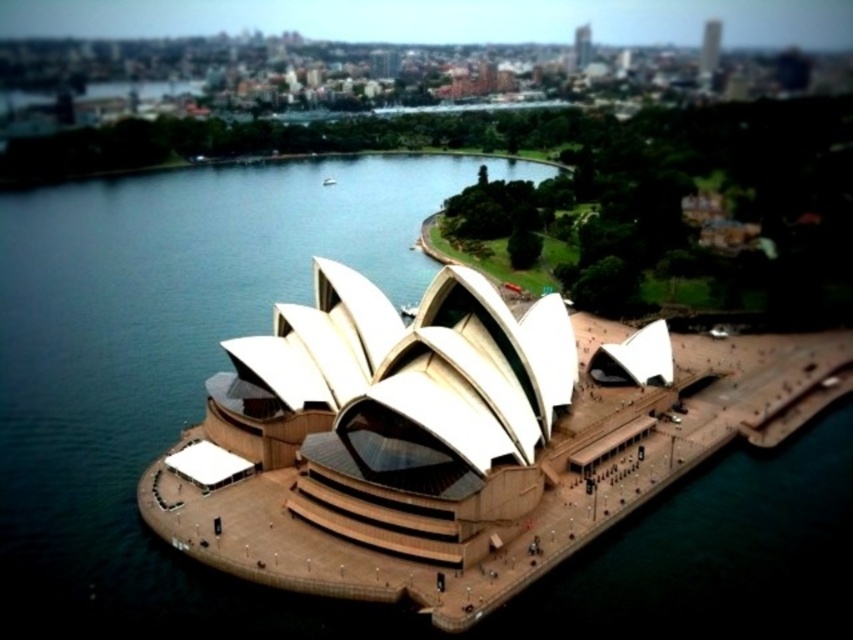
Is white glossy boat at center positioned before white matte boat at center?

Yes, white glossy boat at center is closer to the viewer.

Where is `white glossy boat at center`? The height and width of the screenshot is (640, 853). white glossy boat at center is located at coordinates (408, 308).

Is point (410, 310) closer to camera compared to point (334, 182)?

Yes, point (410, 310) is in front of point (334, 182).

You are a GUI agent. You are given a task and a screenshot of the screen. Output one action in this format:
    pyautogui.click(x=<x>, y=<y>)
    Task: Click on the white glossy boat at center
    
    Given the screenshot: What is the action you would take?
    pyautogui.click(x=408, y=308)

Can you confirm if white fabric opera house at center is positioned below white matte boat at center?

Yes.

Can you confirm if white fabric opera house at center is taller than white matte boat at center?

Yes.

Between point (404, 451) and point (328, 180), which one is positioned in front?

Point (404, 451) is more forward.

This screenshot has height=640, width=853. I want to click on white fabric opera house at center, so click(x=457, y=438).

Which is more to the right, clear blue water at center or white glossy boat at center?

white glossy boat at center is more to the right.

Can you confirm if clear blue water at center is taller than white glossy boat at center?

Yes.

Image resolution: width=853 pixels, height=640 pixels. Describe the element at coordinates (170, 371) in the screenshot. I see `clear blue water at center` at that location.

Find the location of `clear blue water at center`. clear blue water at center is located at coordinates (170, 371).